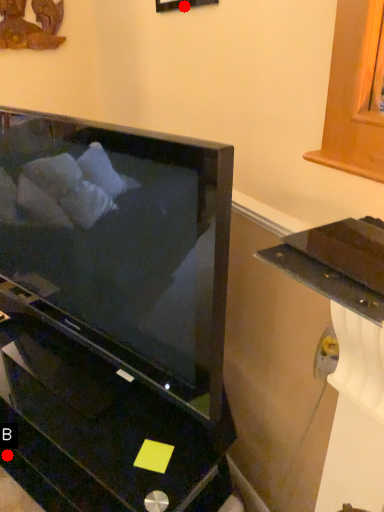
Question: Two points are circled on the image, labeled by A and B beside each circle. Which point is farther to the camera?

Choices:
 (A) A is further
 (B) B is further

Answer: (B)